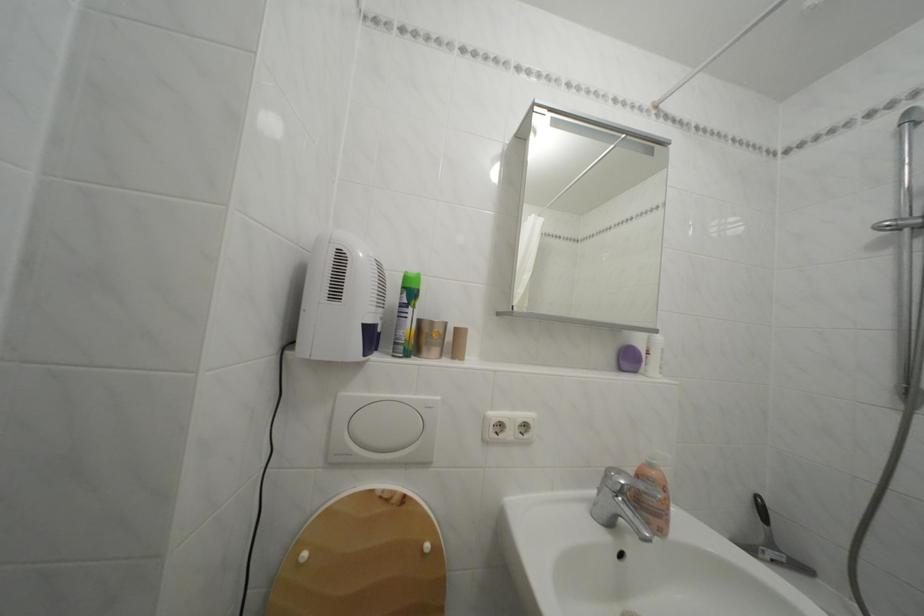
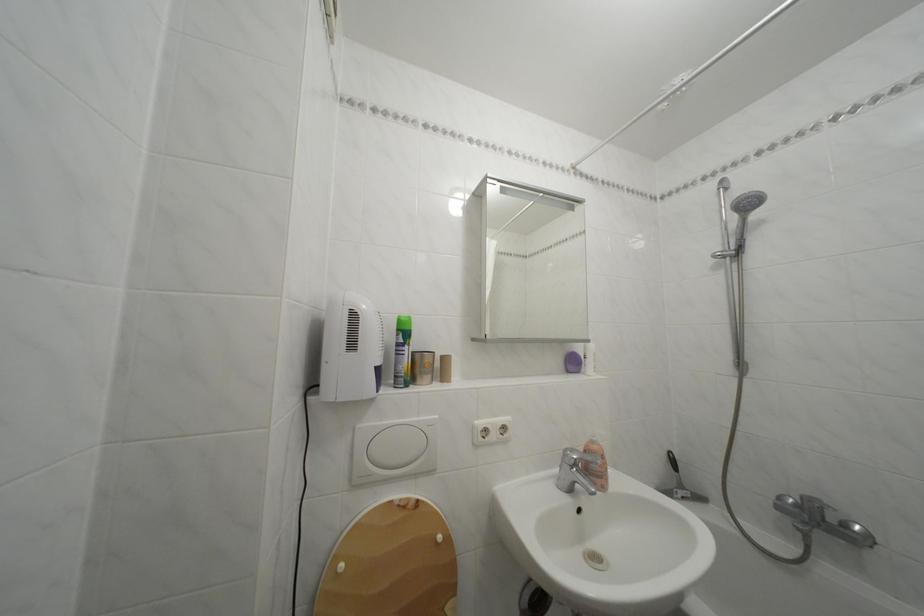
The point at (313, 561) is marked in the first image. Where is the corresponding point in the second image?

(350, 573)